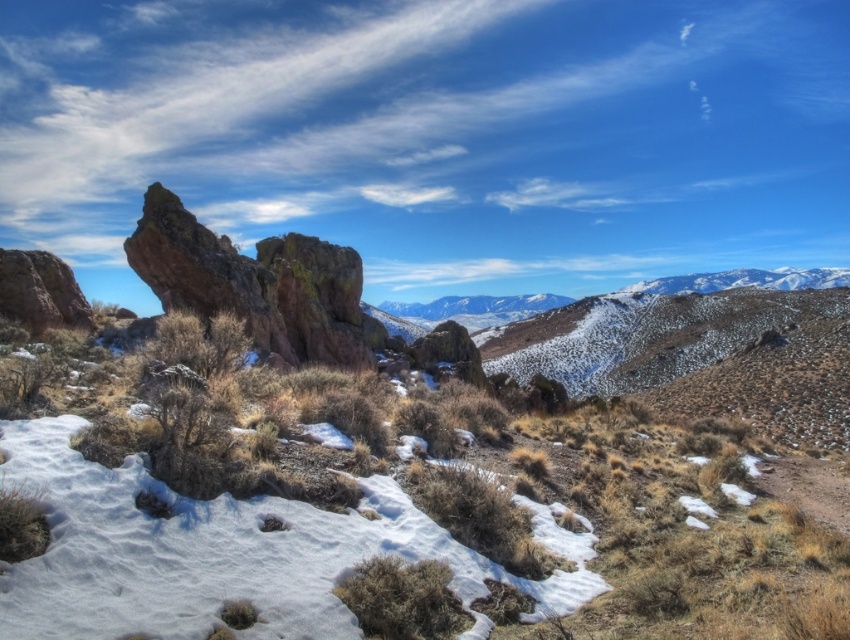
Is the position of rustic rock formation at center more distant than that of rustic brown rock at center-left?

No, it is not.

How much distance is there between rustic rock formation at center and rustic brown rock at center-left?

rustic rock formation at center and rustic brown rock at center-left are 39.15 meters apart.

Between point (142, 506) and point (290, 332), which one is positioned in front?

Point (142, 506)

Where is `rustic rock formation at center`? rustic rock formation at center is located at coordinates (435, 481).